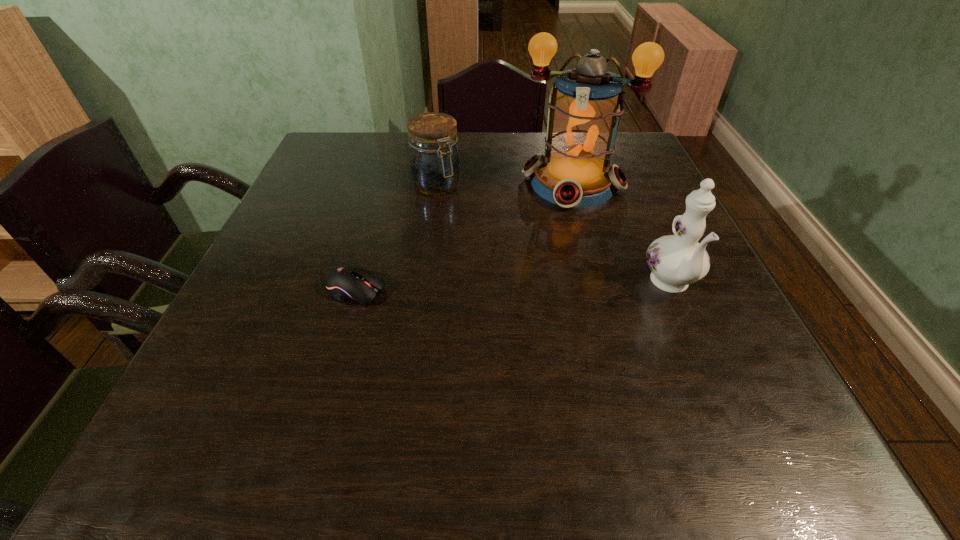
Find the location of a particular element. free space located on the front-facing side of the lantern is located at coordinates (549, 256).

You are a GUI agent. You are given a task and a screenshot of the screen. Output one action in this format:
    pyautogui.click(x=<x>, y=<y>)
    Task: Click on the vacant point located on the lid of the third object from right to left
    This screenshot has width=960, height=540.
    Given the screenshot: What is the action you would take?
    pyautogui.click(x=488, y=245)

I want to click on vacant space located on the lid of the third object from right to left, so click(516, 278).

In order to click on free location located on the lid of the third object from right to left in this screenshot , I will do `click(468, 221)`.

Locate an element on the screen. This screenshot has height=540, width=960. lantern that is positioned at the far edge is located at coordinates (575, 172).

This screenshot has height=540, width=960. What are the coordinates of `jar positioned at the far edge` in the screenshot? It's located at (434, 160).

Find the location of a particular element. The width and height of the screenshot is (960, 540). chinaware at the right edge is located at coordinates (676, 261).

Identify the location of lantern at the right edge. This screenshot has width=960, height=540. (575, 172).

Where is `object that is at the far right corner`? The image size is (960, 540). object that is at the far right corner is located at coordinates (575, 172).

Find the location of a particular element. vacant space at the far edge of the desktop is located at coordinates (377, 147).